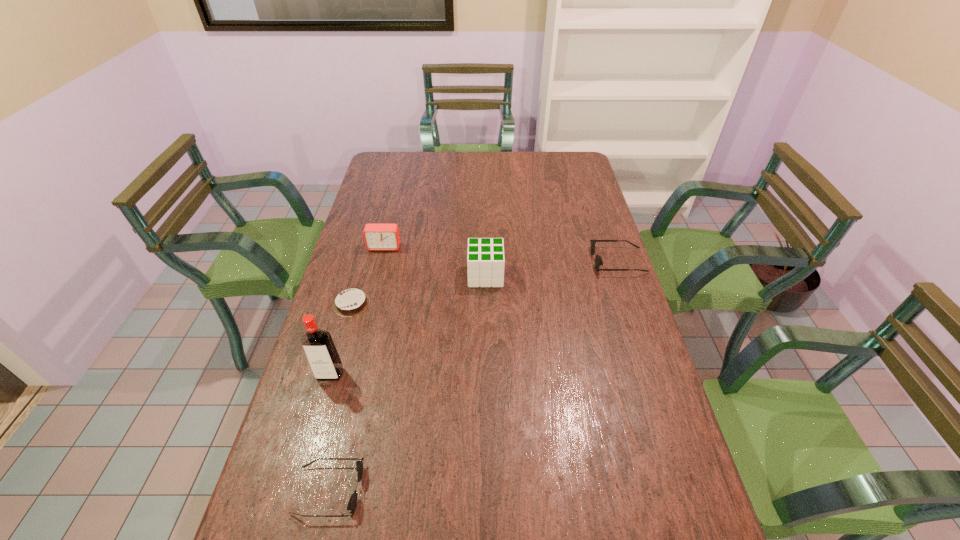
Locate an element on the screen. This screenshot has width=960, height=540. the left sunglasses is located at coordinates (352, 503).

Image resolution: width=960 pixels, height=540 pixels. I want to click on the shorter sunglasses, so click(352, 503).

At what (x,y) coordinates should I click in order to perform the action: click on the farther sunglasses. Please return your answer as a coordinate pair (x, y). The height and width of the screenshot is (540, 960). Looking at the image, I should click on (598, 261).

Image resolution: width=960 pixels, height=540 pixels. I want to click on the taller sunglasses, so click(x=598, y=261).

You are a GUI agent. You are given a task and a screenshot of the screen. Output one action in this format:
    pyautogui.click(x=<x>, y=<y>)
    Task: Click on the fourth shortest object
    Image resolution: width=960 pixels, height=540 pixels.
    Given the screenshot: What is the action you would take?
    pyautogui.click(x=378, y=237)

In order to click on the second tallest object in this screenshot , I will do `click(485, 261)`.

This screenshot has width=960, height=540. What are the coordinates of `the second object from right to left` in the screenshot? It's located at (485, 261).

Locate an element on the screen. the shortest object is located at coordinates click(352, 302).

This screenshot has width=960, height=540. In order to click on chocolate cake in this screenshot , I will do `click(352, 302)`.

I want to click on vodka, so click(320, 350).